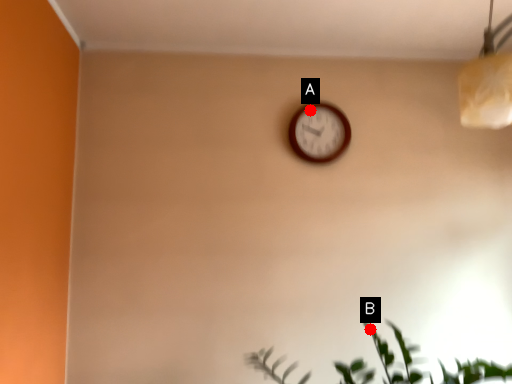
Question: Two points are circled on the image, labeled by A and B beside each circle. Which point is farther from the camera taking this photo?

Choices:
 (A) A is further
 (B) B is further

Answer: (A)